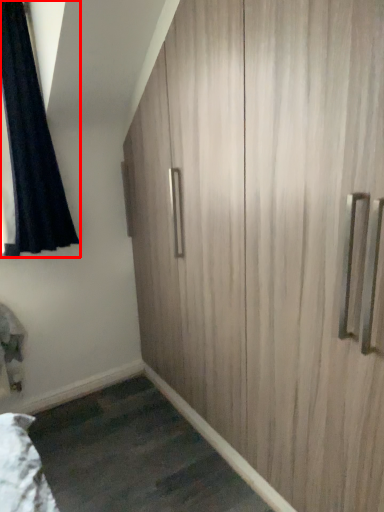
Question: Where is curtain (annotated by the red box) located in relation to cupboard in the image?

Choices:
 (A) left
 (B) right

Answer: (A)